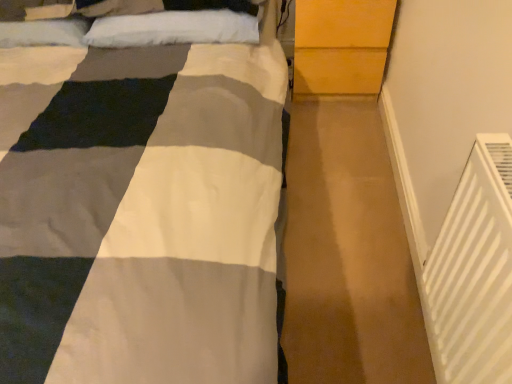
Question: Could you tell me if light brown wood dresser at upper right is turned towards white fluffy pillow at upper center?

Choices:
 (A) yes
 (B) no

Answer: (B)

Question: Does light brown wood dresser at upper right appear on the right side of white fluffy pillow at upper center?

Choices:
 (A) no
 (B) yes

Answer: (B)

Question: Is light brown wood dresser at upper right thinner than white fluffy pillow at upper center?

Choices:
 (A) no
 (B) yes

Answer: (A)

Question: Does light brown wood dresser at upper right have a smaller size compared to white fluffy pillow at upper center?

Choices:
 (A) yes
 (B) no

Answer: (B)

Question: Is light brown wood dresser at upper right wider than white fluffy pillow at upper center?

Choices:
 (A) no
 (B) yes

Answer: (B)

Question: Considering the positions of white plastic radiator at lower right and white fluffy pillow at upper center in the image, is white plastic radiator at lower right taller or shorter than white fluffy pillow at upper center?

Choices:
 (A) short
 (B) tall

Answer: (B)

Question: Is point (510, 349) positioned closer to the camera than point (141, 29)?

Choices:
 (A) closer
 (B) farther

Answer: (A)

Question: Do you think white plastic radiator at lower right is within white fluffy pillow at upper center, or outside of it?

Choices:
 (A) inside
 (B) outside

Answer: (B)

Question: From a real-world perspective, is white plastic radiator at lower right physically located above or below white fluffy pillow at upper center?

Choices:
 (A) above
 (B) below

Answer: (A)

Question: Would you say light brown wood dresser at upper right is to the left or to the right of white fluffy pillow at upper center in the picture?

Choices:
 (A) right
 (B) left

Answer: (A)

Question: From a real-world perspective, is light brown wood dresser at upper right physically located above or below white fluffy pillow at upper center?

Choices:
 (A) above
 (B) below

Answer: (B)

Question: Considering the positions of light brown wood dresser at upper right and white fluffy pillow at upper center in the image, is light brown wood dresser at upper right taller or shorter than white fluffy pillow at upper center?

Choices:
 (A) tall
 (B) short

Answer: (A)

Question: Is light brown wood dresser at upper right in front of or behind white fluffy pillow at upper center in the image?

Choices:
 (A) behind
 (B) front

Answer: (A)

Question: In the image, is white plastic radiator at lower right on the left side or the right side of light brown wood dresser at upper right?

Choices:
 (A) left
 (B) right

Answer: (B)

Question: Is white plastic radiator at lower right wider or thinner than light brown wood dresser at upper right?

Choices:
 (A) wide
 (B) thin

Answer: (B)